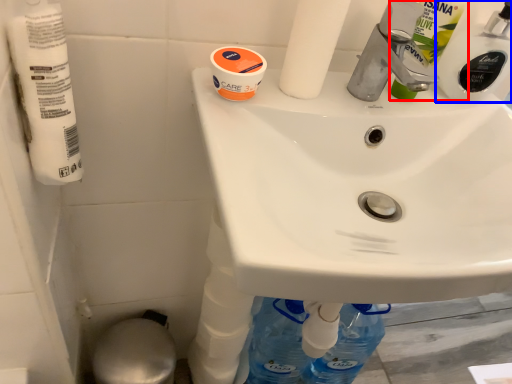
Question: Which point is further to the camera, cleaning product (highlighted by a red box) or cleaning product (highlighted by a blue box)?

Choices:
 (A) cleaning product
 (B) cleaning product

Answer: (B)